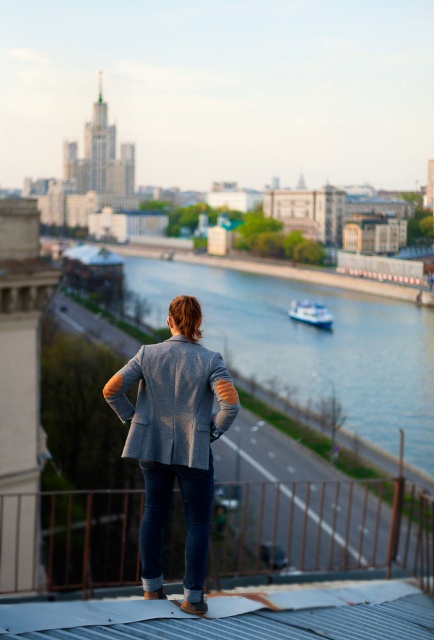
Question: Is brown metal railing at lower center to the left of smooth blue water at center from the viewer's perspective?

Choices:
 (A) no
 (B) yes

Answer: (B)

Question: Can you confirm if smooth blue water at center is positioned to the left of gray woolen blazer at center?

Choices:
 (A) no
 (B) yes

Answer: (A)

Question: Among these points, which one is nearest to the camera?

Choices:
 (A) (210, 268)
 (B) (141, 528)

Answer: (B)

Question: Which point is closer to the camera taking this photo?

Choices:
 (A) (397, 509)
 (B) (167, 444)
 (C) (292, 314)
 (D) (265, 340)

Answer: (B)

Question: Which of the following is the farthest from the observer?

Choices:
 (A) smooth blue water at center
 (B) white glossy boat at center

Answer: (B)

Question: Where is brown metal railing at lower center located in relation to smooth blue water at center in the image?

Choices:
 (A) below
 (B) above

Answer: (A)